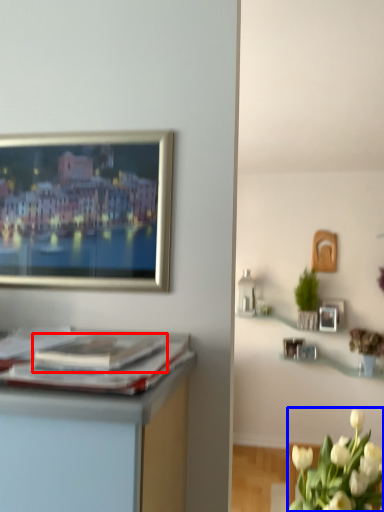
Question: Which of the following is the farthest to the observer, magazine (highlighted by a red box) or flower (highlighted by a blue box)?

Choices:
 (A) magazine
 (B) flower

Answer: (B)